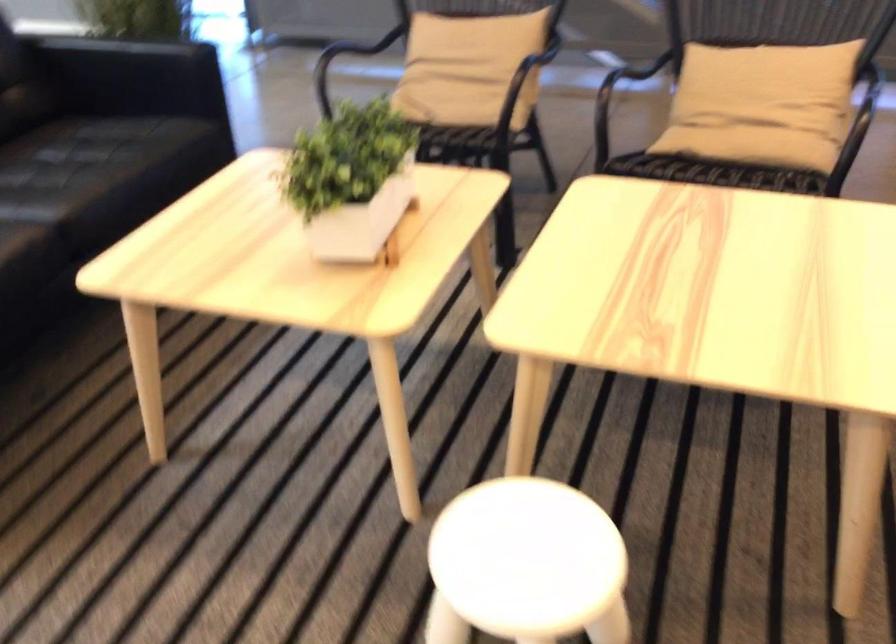
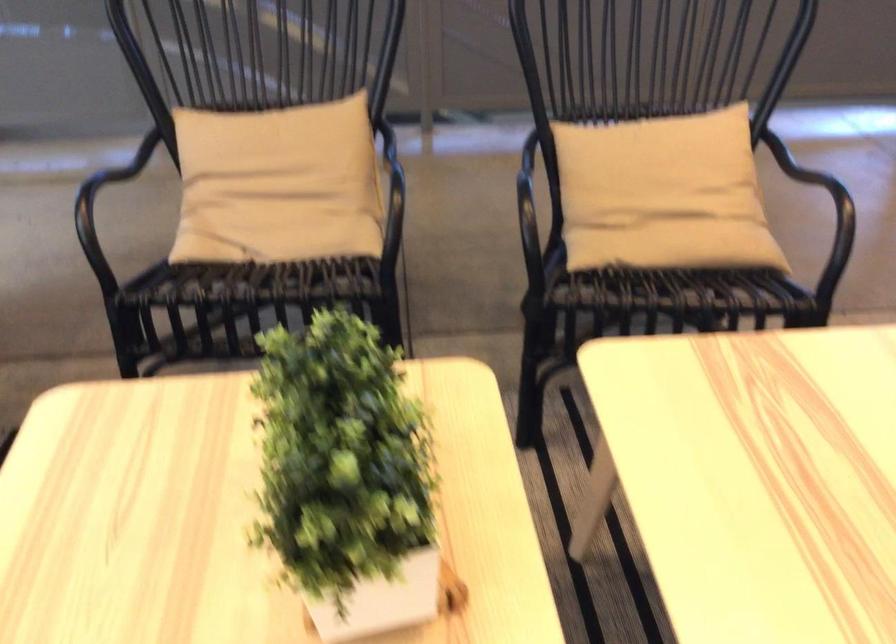
Where in the second image is the point corresponding to point (739, 140) from the first image?

(674, 245)